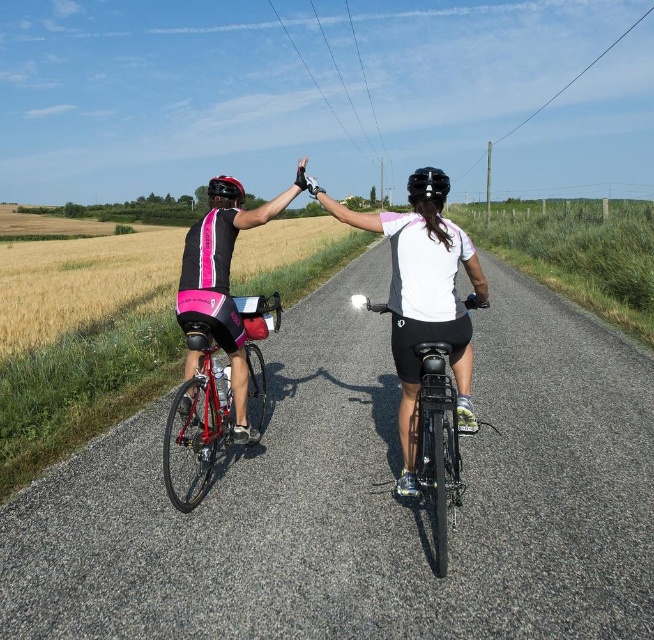
Question: Which of the following is the farthest from the observer?

Choices:
 (A) (453, 497)
 (B) (434, 180)

Answer: (B)

Question: Considering the relative positions of shiny red bicycle at left and black matte bicycle at center in the image provided, where is shiny red bicycle at left located with respect to black matte bicycle at center?

Choices:
 (A) left
 (B) right

Answer: (A)

Question: Considering the relative positions of white matte jersey at center and shiny red bicycle at left in the image provided, where is white matte jersey at center located with respect to shiny red bicycle at left?

Choices:
 (A) left
 (B) right

Answer: (B)

Question: Can you confirm if white matte jersey at center is bigger than shiny red bicycle at left?

Choices:
 (A) yes
 (B) no

Answer: (B)

Question: Which object is farther from the camera taking this photo?

Choices:
 (A) shiny red bicycle at left
 (B) black matte bicycle helmet at center
 (C) white matte jersey at center
 (D) black matte bicycle at center

Answer: (A)

Question: Which object is farther from the camera taking this photo?

Choices:
 (A) black matte bicycle helmet at center
 (B) black matte bicycle at center
 (C) white matte jersey at center

Answer: (A)